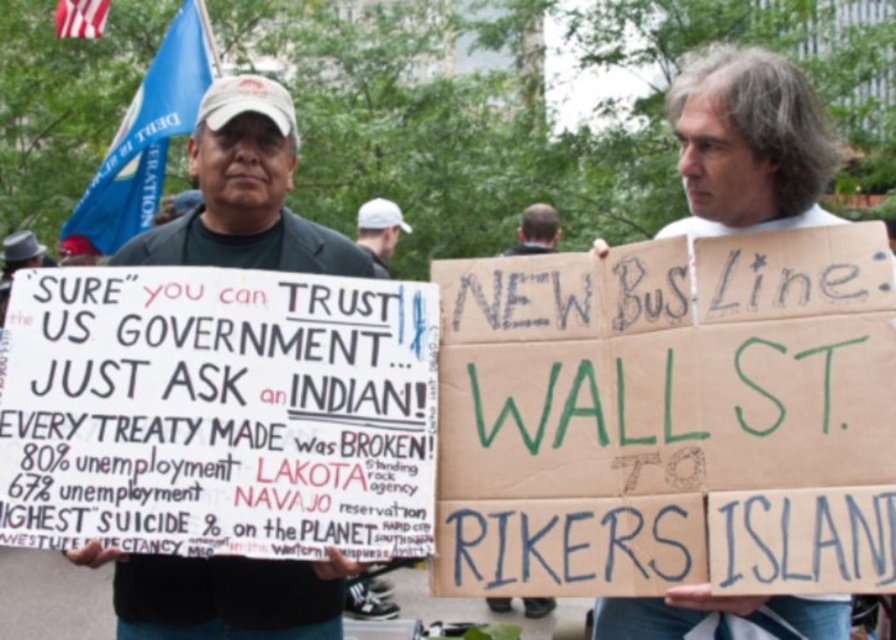
Who is positioned more to the left, dark green shirt at center or white cardboard sign at center?

dark green shirt at center

Between dark green shirt at center and white cardboard sign at center, which one has less height?

With less height is dark green shirt at center.

Is point (151, 621) closer to viewer compared to point (704, 90)?

No, it is not.

At what (x,y) coordinates should I click in order to perform the action: click on dark green shirt at center. Please return your answer as a coordinate pair (x, y). Looking at the image, I should click on (246, 193).

Is white matte baseball cap at center taller than dark brown hair at center?

Yes.

Where is `white matte baseball cap at center`? The image size is (896, 640). white matte baseball cap at center is located at coordinates (x=378, y=230).

Does white cardboard sign at center have a lesser width compared to dark brown hair at center?

Incorrect, white cardboard sign at center's width is not less than dark brown hair at center's.

Who is higher up, white cardboard sign at center or dark brown hair at center?

Positioned higher is white cardboard sign at center.

Is point (645, 628) closer to viewer compared to point (524, 209)?

Yes, point (645, 628) is in front of point (524, 209).

I want to click on white cardboard sign at center, so click(x=748, y=144).